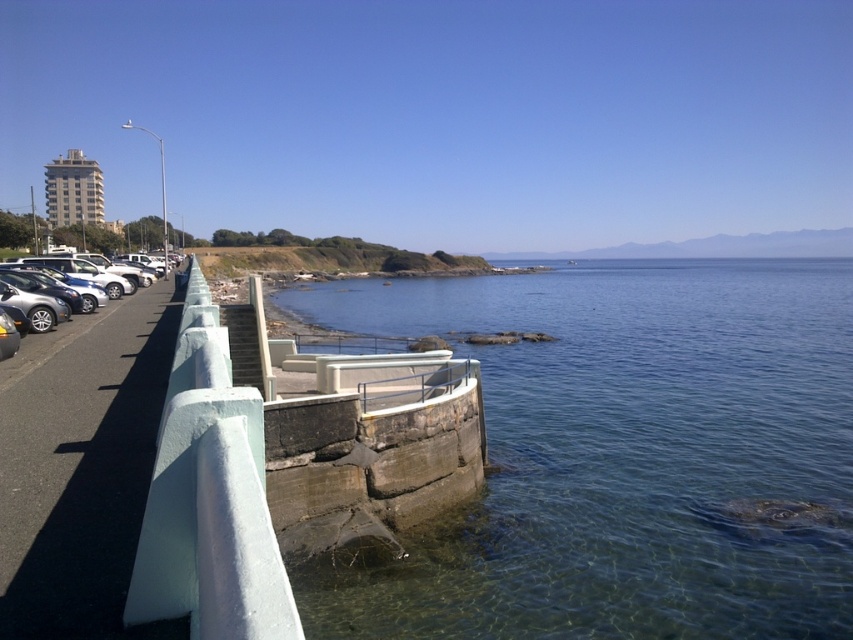
Question: Where is clear blue water at lower center located in relation to matte silver sedan at left in the image?

Choices:
 (A) above
 (B) below

Answer: (A)

Question: Is clear blue water at lower center to the right of matte silver sedan at left from the viewer's perspective?

Choices:
 (A) yes
 (B) no

Answer: (A)

Question: Among these objects, which one is farthest from the camera?

Choices:
 (A) matte silver sedan at left
 (B) clear blue water at lower center

Answer: (B)

Question: Does clear blue water at lower center have a greater width compared to matte silver sedan at left?

Choices:
 (A) no
 (B) yes

Answer: (B)

Question: Which of the following is the closest to the observer?

Choices:
 (A) clear blue water at lower center
 (B) matte silver sedan at left

Answer: (B)